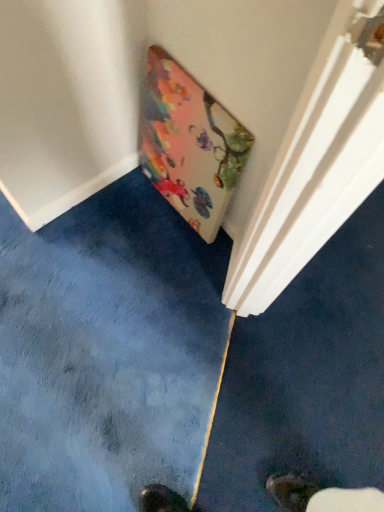
In order to face multicolored fabric art at upper right, should I rotate leftwards or rightwards?

It's best to rotate left around 1.143 degrees.

This screenshot has width=384, height=512. What do you see at coordinates (189, 144) in the screenshot?
I see `multicolored fabric art at upper right` at bounding box center [189, 144].

Measure the distance between multicolored fabric art at upper right and camera.

They are 35.16 inches apart.

Where is `multicolored fabric art at upper right`? multicolored fabric art at upper right is located at coordinates (189, 144).

What are the coordinates of `multicolored fabric art at upper right` in the screenshot? It's located at (189, 144).